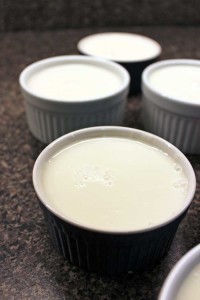
Identify the location of white ramikins. (136, 64), (107, 230), (169, 278), (91, 98), (166, 98).